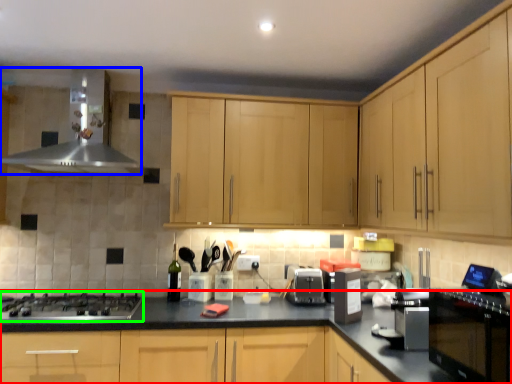
Question: Which object is the closest to the countertop (highlighted by a red box)? Choose among these: home appliance (highlighted by a blue box) or gas stove (highlighted by a green box).

Choices:
 (A) home appliance
 (B) gas stove

Answer: (B)